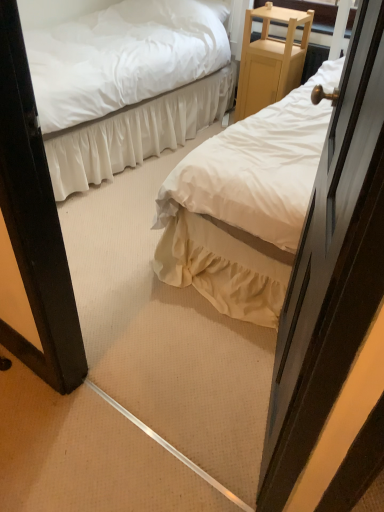
Question: Considering the positions of white satin bed at center, arranged as the 2th bed when viewed from the right, and white cotton bed at center, which is the 2th bed in left-to-right order, in the image, is white satin bed at center, arranged as the 2th bed when viewed from the right, bigger or smaller than white cotton bed at center, which is the 2th bed in left-to-right order,?

Choices:
 (A) big
 (B) small

Answer: (A)

Question: Considering the positions of white satin bed at center, arranged as the 2th bed when viewed from the right, and white cotton bed at center, which ranks as the 1th bed in right-to-left order, in the image, is white satin bed at center, arranged as the 2th bed when viewed from the right, wider or thinner than white cotton bed at center, which ranks as the 1th bed in right-to-left order,?

Choices:
 (A) thin
 (B) wide

Answer: (A)

Question: Estimate the real-world distances between objects in this image. Which object is farther from the white satin bed at center, arranged as the 1th bed when viewed from the left?

Choices:
 (A) white cotton bed at center, which is the 2th bed in left-to-right order
 (B) wooden door at right
 (C) light wood/finely crafted nightstand at upper right

Answer: (B)

Question: Which is farther from the wooden door at right?

Choices:
 (A) white satin bed at center, arranged as the 2th bed when viewed from the right
 (B) white cotton bed at center, which is the 2th bed in left-to-right order
 (C) light wood/finely crafted nightstand at upper right

Answer: (C)